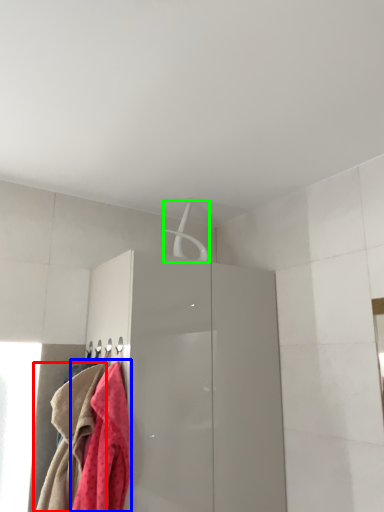
Question: Estimate the real-world distances between objects in this image. Which object is closer to towel (highlighted by a red box), towel (highlighted by a blue box) or hanger (highlighted by a green box)?

Choices:
 (A) towel
 (B) hanger

Answer: (A)